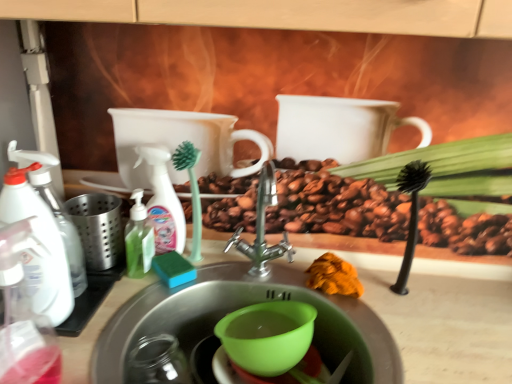
Find the location of a particular element. vacant space to the right of green plastic spray bottle at center, the 1th cleaning product from the right is located at coordinates (227, 268).